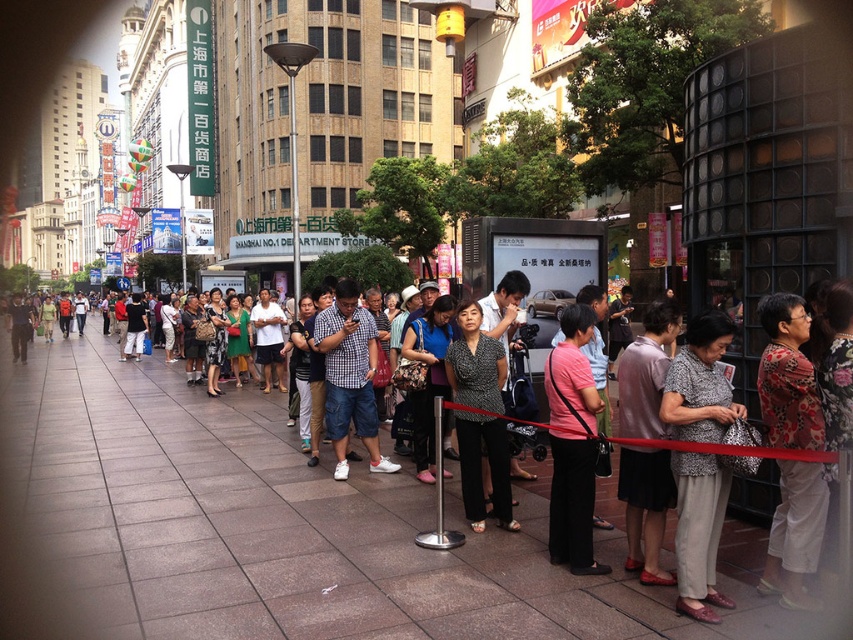
From the picture: You are a photographer trying to capture a clear shot of the brown stone pavement at center and the checkered fabric shirt at center in the urban scene. Which object is positioned lower in the image?

The brown stone pavement at center is located below the checkered fabric shirt at center, so it is positioned lower in the image.

You are a city planner analyzing this urban scene. The brown stone pavement at center and checkered fabric shirt at center are both at the center of the image. Which object occupies more horizontal space in the scene?

The brown stone pavement at center occupies more horizontal space than the checkered fabric shirt at center because its width is larger, as stated in the description.